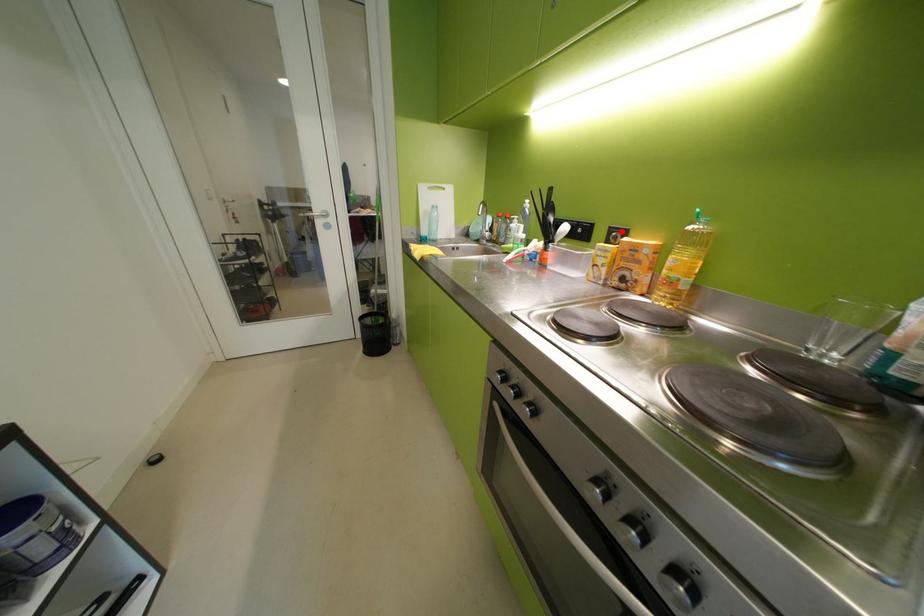
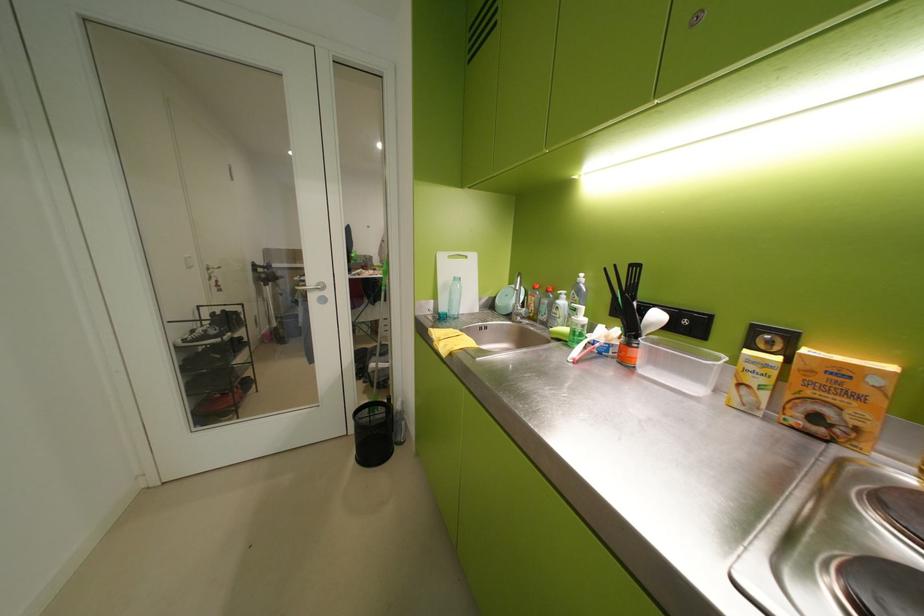
In the second image, find the point that corresponds to the highlighted location in the first image.

(767, 331)